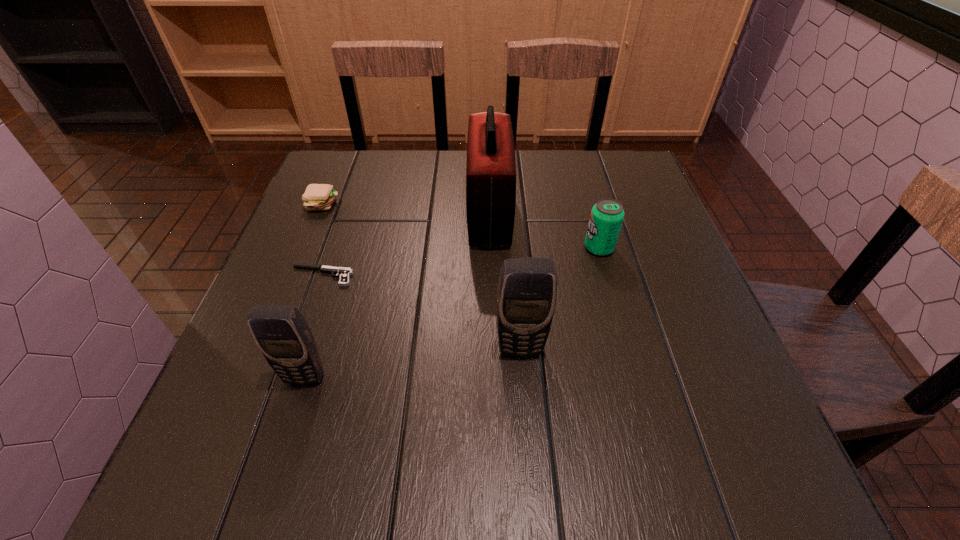
This screenshot has width=960, height=540. What are the coordinates of `unoccupied area between the fourth tallest object and the first aid kit` in the screenshot? It's located at (544, 231).

Where is `empty space between the third nearest object and the taller cellular telephone`? This screenshot has height=540, width=960. empty space between the third nearest object and the taller cellular telephone is located at coordinates (421, 313).

You are a GUI agent. You are given a task and a screenshot of the screen. Output one action in this format:
    pyautogui.click(x=<x>, y=<y>)
    Task: Click on the empty space that is in between the second shortest object and the fourth shortest object
    
    Given the screenshot: What is the action you would take?
    pyautogui.click(x=314, y=291)

Locate an element on the screen. The width and height of the screenshot is (960, 540). object that can be found as the closest to the rightmost object is located at coordinates pos(491,167).

Identify the location of object that is the closest to the shortest object. (317, 196).

The image size is (960, 540). In order to click on blank space that satisfies the following two spatial constraints: 1. on the side of the first aid kit with the cross symbol; 2. on the front face of the fourth shortest object in this screenshot , I will do `click(493, 377)`.